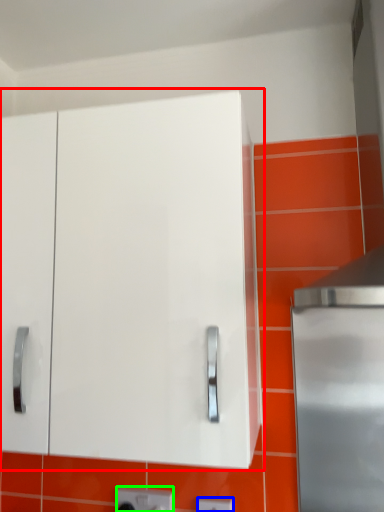
Question: Which object is positioned closest to cabinetry (highlighted by a red box)? Select from electric outlet (highlighted by a blue box) and electric outlet (highlighted by a green box).

Choices:
 (A) electric outlet
 (B) electric outlet

Answer: (B)